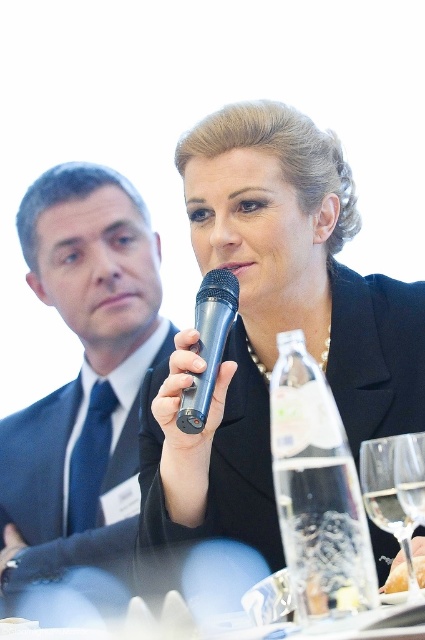
Question: Does metallic blue microphone at center appear on the left side of transparent glass wine glass at center?

Choices:
 (A) no
 (B) yes

Answer: (B)

Question: Among these points, which one is nearest to the camera?

Choices:
 (A) (70, 305)
 (B) (410, 557)
 (C) (360, 440)
 (D) (198, 412)

Answer: (B)

Question: Which point is closer to the camera?

Choices:
 (A) tap(192, 408)
 (B) tap(393, 451)

Answer: (B)

Question: From the image, what is the correct spatial relationship of black matte microphone at center in relation to metallic blue microphone at center?

Choices:
 (A) above
 (B) below

Answer: (A)

Question: Observing the image, what is the correct spatial positioning of black matte microphone at center in reference to transparent glass wine glass at center?

Choices:
 (A) above
 (B) below

Answer: (A)

Question: Estimate the real-world distances between objects in this image. Which object is closer to the metallic blue microphone at center?

Choices:
 (A) dark blue suit at left
 (B) transparent glass wine glass at center

Answer: (B)